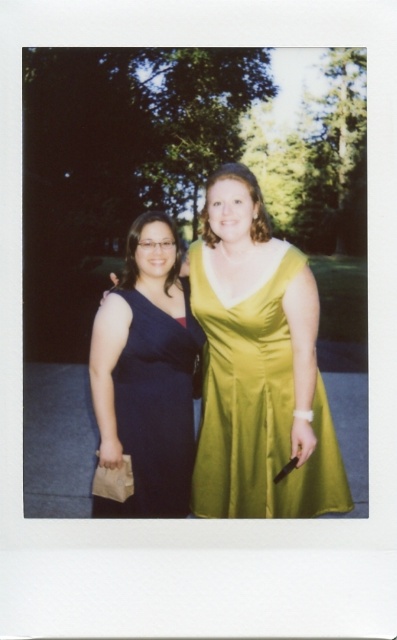
Question: Which of the following is the closest to the observer?

Choices:
 (A) (127, 387)
 (B) (242, 493)

Answer: (A)

Question: Which of the following is the closest to the observer?

Choices:
 (A) (200, 348)
 (B) (304, 483)

Answer: (B)

Question: Does satin yellow dress at center appear on the right side of matte blue dress at left?

Choices:
 (A) no
 (B) yes

Answer: (B)

Question: Is the position of satin yellow dress at center less distant than that of matte blue dress at left?

Choices:
 (A) yes
 (B) no

Answer: (A)

Question: Among these objects, which one is nearest to the camera?

Choices:
 (A) matte blue dress at left
 (B) satin yellow dress at center

Answer: (B)

Question: Is satin yellow dress at center positioned behind matte blue dress at left?

Choices:
 (A) yes
 (B) no

Answer: (B)